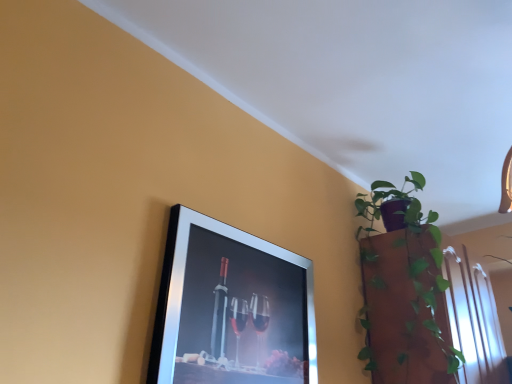
Where is `silver metallic picture frame at upper left`? This screenshot has height=384, width=512. silver metallic picture frame at upper left is located at coordinates (231, 308).

The width and height of the screenshot is (512, 384). Describe the element at coordinates (231, 308) in the screenshot. I see `silver metallic picture frame at upper left` at that location.

Describe the element at coordinates (404, 289) in the screenshot. I see `green glossy plant at upper right` at that location.

Where is `green glossy plant at upper right`? The height and width of the screenshot is (384, 512). green glossy plant at upper right is located at coordinates (404, 289).

What is the approximate width of green glossy plant at upper right?

11.49 inches.

Measure the distance between point (396, 349) and camera.

The distance of point (396, 349) from camera is 4.99 feet.

What is the approximate height of green glossy plant at upper right?

It is 80.04 centimeters.

Where is `silver metallic picture frame at upper left`? silver metallic picture frame at upper left is located at coordinates (231, 308).

Can you confirm if silver metallic picture frame at upper left is positioned to the left of green glossy plant at upper right?

Yes.

Between silver metallic picture frame at upper left and green glossy plant at upper right, which one is positioned in front?

silver metallic picture frame at upper left is in front.

Does point (269, 279) lie in front of point (358, 204)?

Yes, point (269, 279) is in front of point (358, 204).

From the image's perspective, is silver metallic picture frame at upper left beneath green glossy plant at upper right?

Yes, from the image's perspective, silver metallic picture frame at upper left is below green glossy plant at upper right.

From a real-world perspective, who is located higher, silver metallic picture frame at upper left or green glossy plant at upper right?

From a 3D spatial view, green glossy plant at upper right is above.

Is silver metallic picture frame at upper left wider or thinner than green glossy plant at upper right?

Clearly, silver metallic picture frame at upper left has less width compared to green glossy plant at upper right.

Who is taller, silver metallic picture frame at upper left or green glossy plant at upper right?

Standing taller between the two is green glossy plant at upper right.

Does silver metallic picture frame at upper left have a smaller size compared to green glossy plant at upper right?

Yes.

Is green glossy plant at upper right completely or partially inside silver metallic picture frame at upper left?

Actually, green glossy plant at upper right is outside silver metallic picture frame at upper left.

Is silver metallic picture frame at upper left far from green glossy plant at upper right?

No, silver metallic picture frame at upper left is in close proximity to green glossy plant at upper right.

Is silver metallic picture frame at upper left turned away from green glossy plant at upper right?

No, silver metallic picture frame at upper left is not facing the opposite direction of green glossy plant at upper right.

Can you tell me how much silver metallic picture frame at upper left and green glossy plant at upper right differ in facing direction?

There is a 91.6-degree angle between the facing directions of silver metallic picture frame at upper left and green glossy plant at upper right.

This screenshot has width=512, height=384. I want to click on picture frame in front of the green glossy plant at upper right, so click(231, 308).

In the scene shown: Between green glossy plant at upper right and silver metallic picture frame at upper left, which one appears on the left side from the viewer's perspective?

silver metallic picture frame at upper left is more to the left.

Which object is more forward, green glossy plant at upper right or silver metallic picture frame at upper left?

silver metallic picture frame at upper left is more forward.

Consider the image. Which point is more distant from viewer, (423, 300) or (205, 231)?

Positioned behind is point (423, 300).

From the image's perspective, which is above, green glossy plant at upper right or silver metallic picture frame at upper left?

green glossy plant at upper right.

From a real-world perspective, is green glossy plant at upper right positioned above or below silver metallic picture frame at upper left?

In terms of real-world spatial position, green glossy plant at upper right is above silver metallic picture frame at upper left.

Considering the sizes of objects green glossy plant at upper right and silver metallic picture frame at upper left in the image provided, who is wider, green glossy plant at upper right or silver metallic picture frame at upper left?

Wider between the two is green glossy plant at upper right.

Considering the relative sizes of green glossy plant at upper right and silver metallic picture frame at upper left in the image provided, is green glossy plant at upper right shorter than silver metallic picture frame at upper left?

No.

Is green glossy plant at upper right smaller than silver metallic picture frame at upper left?

Actually, green glossy plant at upper right might be larger than silver metallic picture frame at upper left.

Would you say green glossy plant at upper right contains silver metallic picture frame at upper left?

That's incorrect, silver metallic picture frame at upper left is not inside green glossy plant at upper right.

Is green glossy plant at upper right in contact with silver metallic picture frame at upper left?

No, green glossy plant at upper right is not in contact with silver metallic picture frame at upper left.

Is green glossy plant at upper right facing away from silver metallic picture frame at upper left?

green glossy plant at upper right is not turned away from silver metallic picture frame at upper left.

What's the angular difference between green glossy plant at upper right and silver metallic picture frame at upper left's facing directions?

91.6 degrees.

Find the location of a particular element. This screenshot has height=384, width=512. houseplant that appears above the silver metallic picture frame at upper left (from a real-world perspective) is located at coordinates (404, 289).

This screenshot has height=384, width=512. In the image, there is a green glossy plant at upper right. Identify the location of picture frame below it (from a real-world perspective). (231, 308).

Locate an element on the screen. This screenshot has height=384, width=512. houseplant above the silver metallic picture frame at upper left (from the image's perspective) is located at coordinates (404, 289).